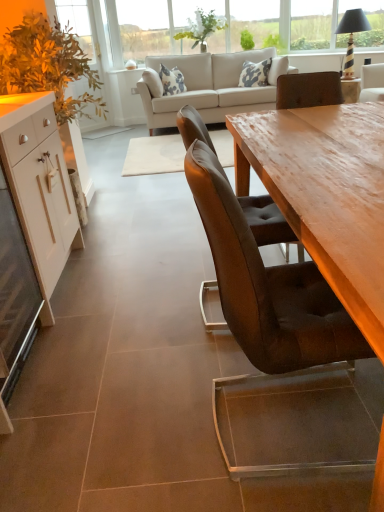
Question: Does white glossy cabinet at left lie behind leather chair at center?

Choices:
 (A) no
 (B) yes

Answer: (B)

Question: Considering the relative sizes of white glossy cabinet at left and leather chair at center in the image provided, is white glossy cabinet at left wider than leather chair at center?

Choices:
 (A) yes
 (B) no

Answer: (B)

Question: Does white glossy cabinet at left lie in front of leather chair at center?

Choices:
 (A) yes
 (B) no

Answer: (B)

Question: Is white glossy cabinet at left in contact with leather chair at center?

Choices:
 (A) no
 (B) yes

Answer: (A)

Question: Can you confirm if white glossy cabinet at left is thinner than leather chair at center?

Choices:
 (A) no
 (B) yes

Answer: (B)

Question: Considering the positions of wooden table at right and clear glass window at upper center in the image, is wooden table at right taller or shorter than clear glass window at upper center?

Choices:
 (A) short
 (B) tall

Answer: (A)

Question: From the image's perspective, is wooden table at right located above or below clear glass window at upper center?

Choices:
 (A) above
 (B) below

Answer: (B)

Question: Based on their positions, is wooden table at right located to the left or right of clear glass window at upper center?

Choices:
 (A) right
 (B) left

Answer: (A)

Question: Looking at their shapes, would you say wooden table at right is wider or thinner than clear glass window at upper center?

Choices:
 (A) wide
 (B) thin

Answer: (A)

Question: In the image, is clear glass window at upper center on the left side or the right side of white glossy cabinet at left?

Choices:
 (A) right
 (B) left

Answer: (A)

Question: From the image's perspective, is clear glass window at upper center above or below white glossy cabinet at left?

Choices:
 (A) above
 (B) below

Answer: (A)

Question: Considering the positions of point (155, 10) and point (41, 214), is point (155, 10) closer or farther from the camera than point (41, 214)?

Choices:
 (A) farther
 (B) closer

Answer: (A)

Question: Is clear glass window at upper center taller or shorter than white glossy cabinet at left?

Choices:
 (A) tall
 (B) short

Answer: (B)

Question: From the image's perspective, is white glossy cabinet at left above or below green leafy plant at upper center, which is counted as the 2th plant, starting from the right?

Choices:
 (A) below
 (B) above

Answer: (A)

Question: In the image, is white glossy cabinet at left positioned in front of or behind green leafy plant at upper center, which appears as the 1th plant when viewed from the left?

Choices:
 (A) front
 (B) behind

Answer: (A)